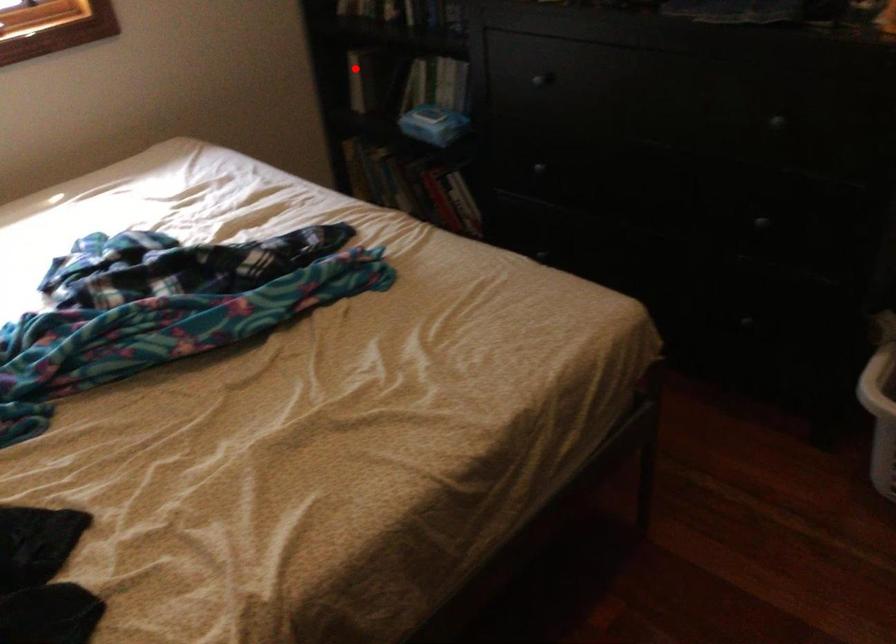
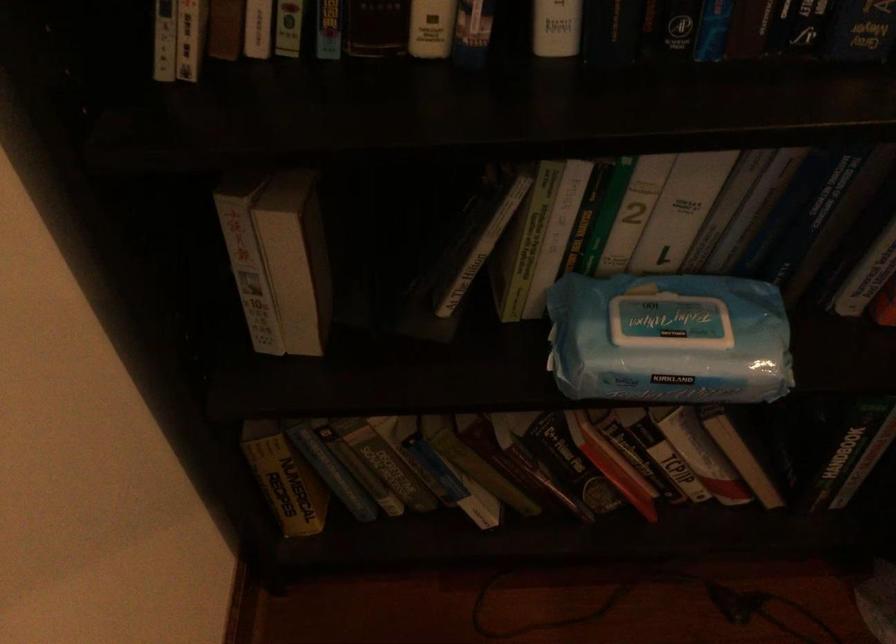
Question: A red point is marked in image1. In image2, is the corresponding 3D point closer to the camera or farther? Reply with the corresponding letter.

Choices:
 (A) The corresponding 3D point is closer.
 (B) The corresponding 3D point is farther.

Answer: (A)